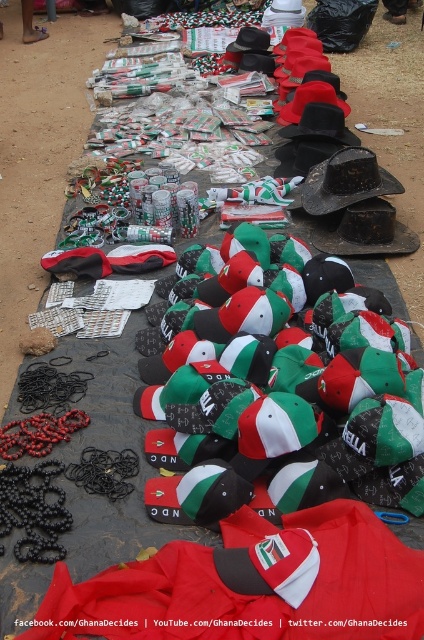
You are setting up a display at the market stall and want to place both the red polyester blanket at lower center and the matte black cowboy hat at center. Since space is limited, which item should you prioritize placing first to ensure both fit?

The red polyester blanket at lower center occupies less space than the matte black cowboy hat at center, so you should place the matte black cowboy hat at center first to ensure there is enough space for it, then fit the smaller red polyester blanket at lower center around it.

You are a customer at the market stall and want to pick up the red polyester blanket at lower center and the matte black cowboy hat at center. Which item should you reach for first to grab both items efficiently?

The red polyester blanket at lower center is closer to the viewer than the matte black cowboy hat at center, so you should reach for the red polyester blanket at lower center first to grab both items efficiently.